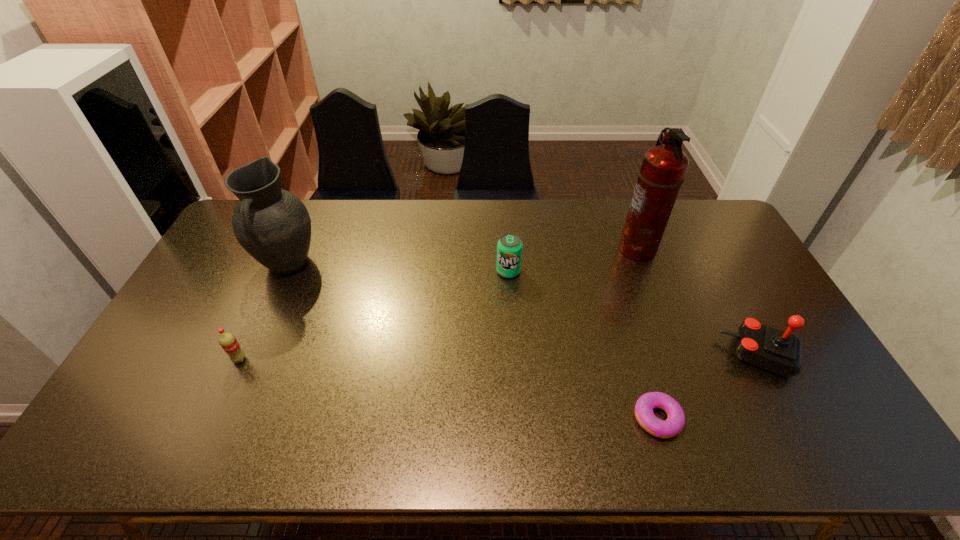
At what (x,y) coordinates should I click in order to perform the action: click on empty location between the third object from left to right and the left soda. Please return your answer as a coordinate pair (x, y). Looking at the image, I should click on (373, 315).

This screenshot has height=540, width=960. What are the coordinates of `vacant space in between the tallest object and the fourth object from right to left` in the screenshot? It's located at (573, 260).

Image resolution: width=960 pixels, height=540 pixels. What are the coordinates of `free area in between the fourth shortest object and the pitcher` in the screenshot? It's located at (524, 309).

Find the location of a particular element. The width and height of the screenshot is (960, 540). vacant area that lies between the tallest object and the rightmost object is located at coordinates (699, 302).

Identify the location of vacant space that is in between the third object from left to right and the fire extinguisher. This screenshot has height=540, width=960. (573, 260).

Identify the location of vacant space that's between the shortest object and the third object from left to right. coord(583,345).

Select which object is the closest to the left soda. Please provide its 2D coordinates. Your answer should be formatted as a tuple, i.e. [(x, y)], where the tuple contains the x and y coordinates of a point satisfying the conditions above.

[(273, 225)]

Where is `the second closest object to the nearer soda`? the second closest object to the nearer soda is located at coordinates (509, 247).

I want to click on vacant area that satisfies the following two spatial constraints: 1. on the nozzle side of the tallest object; 2. on the front-facing side of the right soda, so click(646, 272).

The image size is (960, 540). Find the location of `blank area in the image that satisfies the following two spatial constraints: 1. on the nozzle side of the fire extinguisher; 2. on the back side of the joystick`. blank area in the image that satisfies the following two spatial constraints: 1. on the nozzle side of the fire extinguisher; 2. on the back side of the joystick is located at coordinates (678, 355).